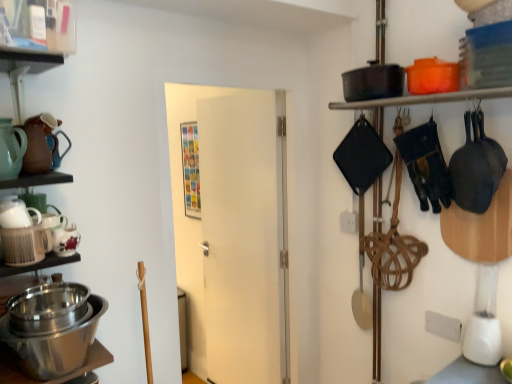
Question: Would you say white plastic blender at right is a long distance from matte black pot at upper right, positioned as the second shelf in front-to-back order?

Choices:
 (A) no
 (B) yes

Answer: (A)

Question: Is white plastic blender at right shorter than matte black pot at upper right, which is counted as the first shelf, starting from the right?

Choices:
 (A) yes
 (B) no

Answer: (B)

Question: Can you confirm if white plastic blender at right is smaller than matte black pot at upper right, positioned as the second shelf in front-to-back order?

Choices:
 (A) no
 (B) yes

Answer: (A)

Question: Is the position of white plastic blender at right less distant than that of matte black pot at upper right, marked as the second shelf in a left-to-right arrangement?

Choices:
 (A) no
 (B) yes

Answer: (A)

Question: From a real-world perspective, does white plastic blender at right stand above matte black pot at upper right, positioned as the second shelf in front-to-back order?

Choices:
 (A) yes
 (B) no

Answer: (B)

Question: Is white plastic blender at right turned away from matte black pot at upper right, marked as the second shelf in a left-to-right arrangement?

Choices:
 (A) yes
 (B) no

Answer: (B)

Question: Can you confirm if white plastic blender at right is shorter than matte ceramic teapot at left, arranged as the third tea pot when ordered from the bottom?

Choices:
 (A) no
 (B) yes

Answer: (A)

Question: Is white plastic blender at right with matte ceramic teapot at left, arranged as the 2th tea pot when viewed from the top?

Choices:
 (A) yes
 (B) no

Answer: (B)

Question: Does white plastic blender at right lie in front of matte ceramic teapot at left, arranged as the 2th tea pot when viewed from the top?

Choices:
 (A) yes
 (B) no

Answer: (B)

Question: From a real-world perspective, is white plastic blender at right on matte ceramic teapot at left, arranged as the 2th tea pot when viewed from the top?

Choices:
 (A) yes
 (B) no

Answer: (B)

Question: Is white plastic blender at right smaller than matte ceramic teapot at left, arranged as the 2th tea pot when viewed from the top?

Choices:
 (A) yes
 (B) no

Answer: (B)

Question: Does white plastic blender at right have a lesser width compared to matte ceramic teapot at left, arranged as the 2th tea pot when viewed from the top?

Choices:
 (A) yes
 (B) no

Answer: (B)

Question: From the image's perspective, is matte ceramic teapot at left, arranged as the 2th tea pot when viewed from the top, over matte black pot at upper right, the first shelf in the bottom-to-top sequence?

Choices:
 (A) yes
 (B) no

Answer: (B)